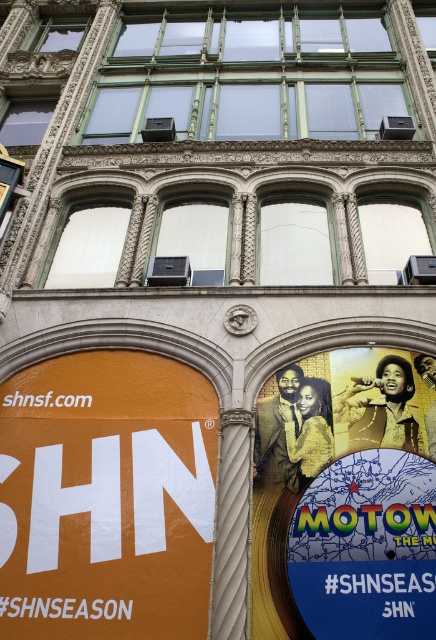
Question: Which point appears farthest from the camera in this image?

Choices:
 (A) (408, 385)
 (B) (6, 433)

Answer: (A)

Question: Is orange matte sign at lower left positioned in front of matte vinyl record at center?

Choices:
 (A) no
 (B) yes

Answer: (A)

Question: Does orange matte sign at lower left have a greater width compared to matte vinyl record at center?

Choices:
 (A) yes
 (B) no

Answer: (A)

Question: Is orange matte sign at lower left smaller than matte vinyl record at center?

Choices:
 (A) yes
 (B) no

Answer: (B)